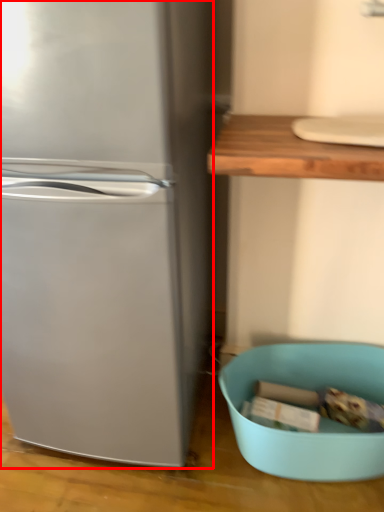
Question: From the image, what is the correct spatial relationship of refrigerator (annotated by the red box) in relation to mixing bowl?

Choices:
 (A) right
 (B) left

Answer: (B)